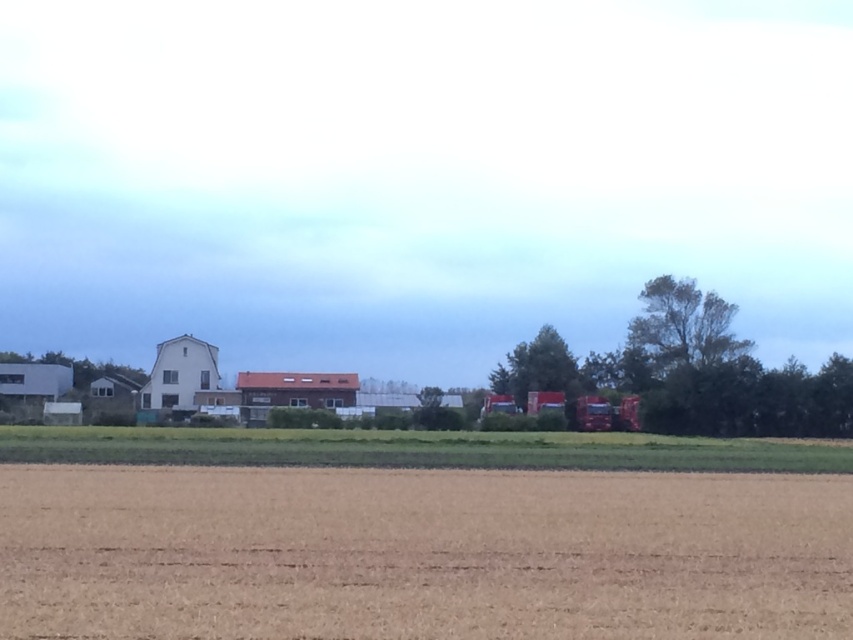
Question: Which of the following is the closest to the observer?

Choices:
 (A) white matte barn at center
 (B) green grass at center

Answer: (B)

Question: Is brown matte wheat field at lower center below white matte barn at center?

Choices:
 (A) no
 (B) yes

Answer: (A)

Question: Is green grass at center behind brown wooden barn at center?

Choices:
 (A) no
 (B) yes

Answer: (A)

Question: Can you confirm if brown matte wheat field at lower center is bigger than white matte barn at center?

Choices:
 (A) yes
 (B) no

Answer: (A)

Question: Which point is farther to the camera?

Choices:
 (A) (287, 384)
 (B) (210, 346)
 (C) (199, 438)
 (D) (509, 627)

Answer: (B)

Question: Based on their relative distances, which object is farther from the brown wooden barn at center?

Choices:
 (A) green grass at center
 (B) brown matte wheat field at lower center

Answer: (B)